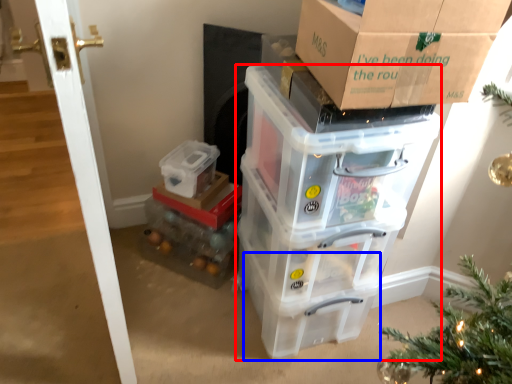
Question: Which point is closer to the camera, storage box (highlighted by a red box) or storage box (highlighted by a blue box)?

Choices:
 (A) storage box
 (B) storage box

Answer: (A)